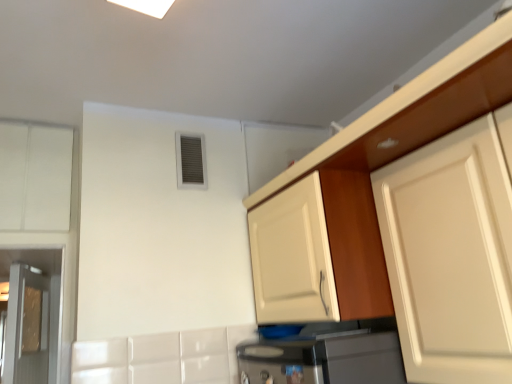
Question: Is white glossy cabinet at upper right, placed as the third cabinetry when sorted from left to right, closer to the viewer compared to metallic glass door at left?

Choices:
 (A) yes
 (B) no

Answer: (A)

Question: Does white glossy cabinet at upper right, acting as the second cabinetry starting from the right, have a greater height compared to metallic glass door at left?

Choices:
 (A) no
 (B) yes

Answer: (A)

Question: Can you see white glossy cabinet at upper right, acting as the second cabinetry starting from the right, touching metallic glass door at left?

Choices:
 (A) yes
 (B) no

Answer: (B)

Question: From the image's perspective, is white glossy cabinet at upper right, acting as the second cabinetry starting from the right, on top of metallic glass door at left?

Choices:
 (A) yes
 (B) no

Answer: (A)

Question: Does white glossy cabinet at upper right, acting as the second cabinetry starting from the right, have a lesser height compared to metallic glass door at left?

Choices:
 (A) yes
 (B) no

Answer: (A)

Question: Would you say matte white cabinet at center, which ranks as the third cabinetry in right-to-left order, is to the left or to the right of white matte cabinet at left, which appears as the 4th cabinetry when viewed from the right, in the picture?

Choices:
 (A) left
 (B) right

Answer: (B)

Question: Considering the positions of matte white cabinet at center, which ranks as the third cabinetry in right-to-left order, and white matte cabinet at left, which appears as the 4th cabinetry when viewed from the right, in the image, is matte white cabinet at center, which ranks as the third cabinetry in right-to-left order, bigger or smaller than white matte cabinet at left, which appears as the 4th cabinetry when viewed from the right,?

Choices:
 (A) small
 (B) big

Answer: (B)

Question: In the image, is matte white cabinet at center, which ranks as the third cabinetry in right-to-left order, positioned in front of or behind white matte cabinet at left, the 1th cabinetry viewed from the left?

Choices:
 (A) behind
 (B) front

Answer: (B)

Question: Looking at their shapes, would you say matte white cabinet at center, which appears as the second cabinetry when viewed from the left, is wider or thinner than white matte cabinet at left, the 1th cabinetry viewed from the left?

Choices:
 (A) thin
 (B) wide

Answer: (B)

Question: Is white matte cabinet at upper right, which ranks as the fourth cabinetry in left-to-right order, wider or thinner than metallic glass door at left?

Choices:
 (A) thin
 (B) wide

Answer: (B)

Question: Considering the positions of point (504, 336) and point (42, 350), is point (504, 336) closer or farther from the camera than point (42, 350)?

Choices:
 (A) farther
 (B) closer

Answer: (B)

Question: From a real-world perspective, is white matte cabinet at upper right, which ranks as the fourth cabinetry in left-to-right order, physically located above or below metallic glass door at left?

Choices:
 (A) above
 (B) below

Answer: (A)

Question: Relative to metallic glass door at left, is white matte cabinet at upper right, the first cabinetry viewed from the right, in front or behind?

Choices:
 (A) front
 (B) behind

Answer: (A)

Question: In the image, is white glossy cabinet at upper right, placed as the third cabinetry when sorted from left to right, on the left side or the right side of matte white cabinet at center, which appears as the second cabinetry when viewed from the left?

Choices:
 (A) left
 (B) right

Answer: (B)

Question: Is white glossy cabinet at upper right, acting as the second cabinetry starting from the right, taller or shorter than matte white cabinet at center, which appears as the second cabinetry when viewed from the left?

Choices:
 (A) tall
 (B) short

Answer: (B)